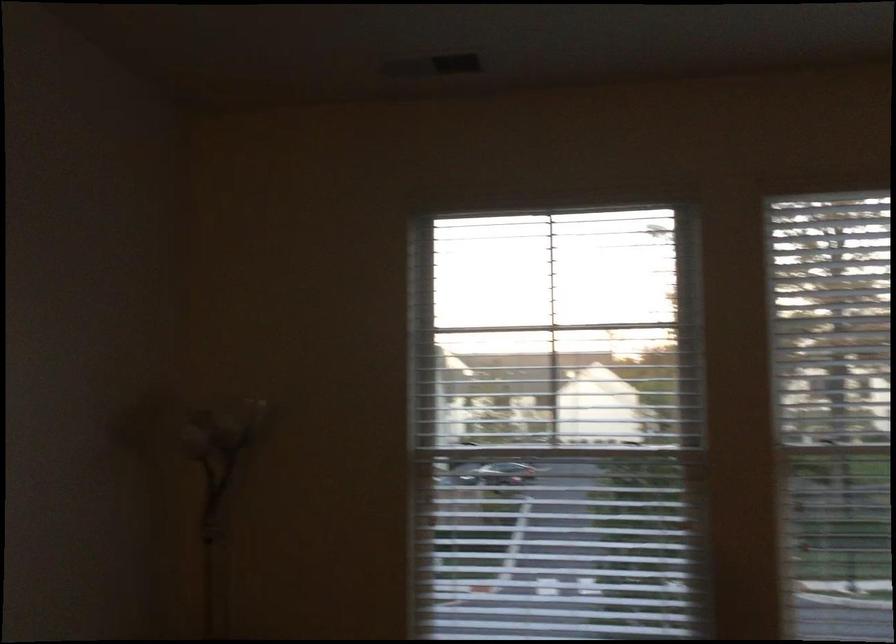
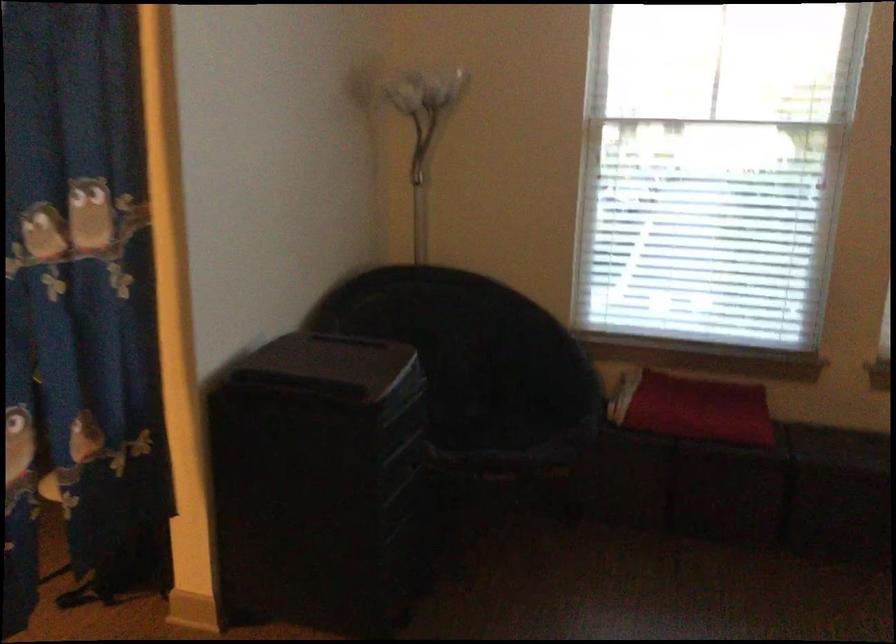
Question: How did the camera likely rotate?

Choices:
 (A) Left
 (B) Right
 (C) Up
 (D) Down

Answer: (D)